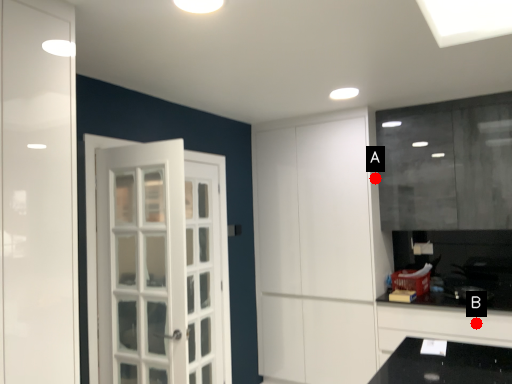
Question: Two points are circled on the image, labeled by A and B beside each circle. Which point is closer to the camera?

Choices:
 (A) A is closer
 (B) B is closer

Answer: (B)